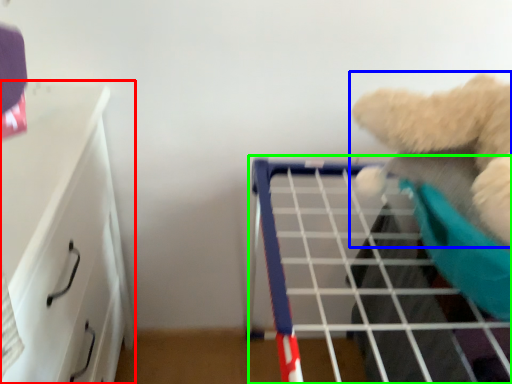
Question: Which object is positioned farthest from furniture (highlighted by a red box)? Select from teddy bear (highlighted by a blue box) and shelf (highlighted by a green box).

Choices:
 (A) teddy bear
 (B) shelf

Answer: (A)